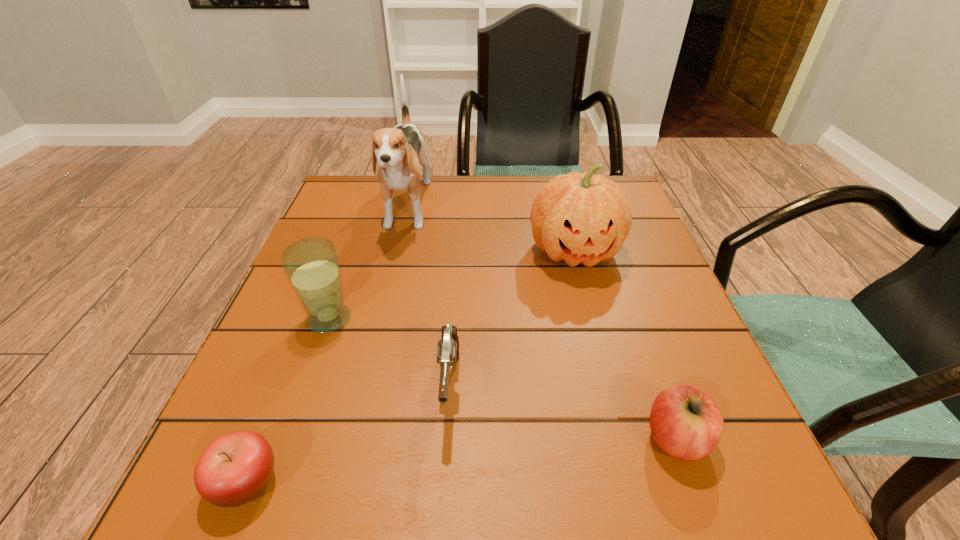
Image resolution: width=960 pixels, height=540 pixels. What are the coordinates of `free space between the second tallest object and the fourth nearest object` in the screenshot? It's located at (451, 285).

At what (x,y) coordinates should I click in order to perform the action: click on vacant area that lies between the right apple and the glass. Please return your answer as a coordinate pair (x, y). This screenshot has height=540, width=960. Looking at the image, I should click on (502, 379).

This screenshot has width=960, height=540. I want to click on object identified as the third closest to the glass, so click(236, 467).

This screenshot has width=960, height=540. Identify the location of the second closest object to the left apple. (312, 266).

You are a GUI agent. You are given a task and a screenshot of the screen. Output one action in this format:
    pyautogui.click(x=<x>, y=<y>)
    Task: Click on the free spot that satisfies the following two spatial constraints: 1. at the face of the tallest object; 2. on the right side of the right apple
    
    Given the screenshot: What is the action you would take?
    click(354, 439)

What are the coordinates of `free point that satisfies the following two spatial constraints: 1. on the back side of the right apple; 2. on the right side of the left apple` in the screenshot? It's located at [263, 439].